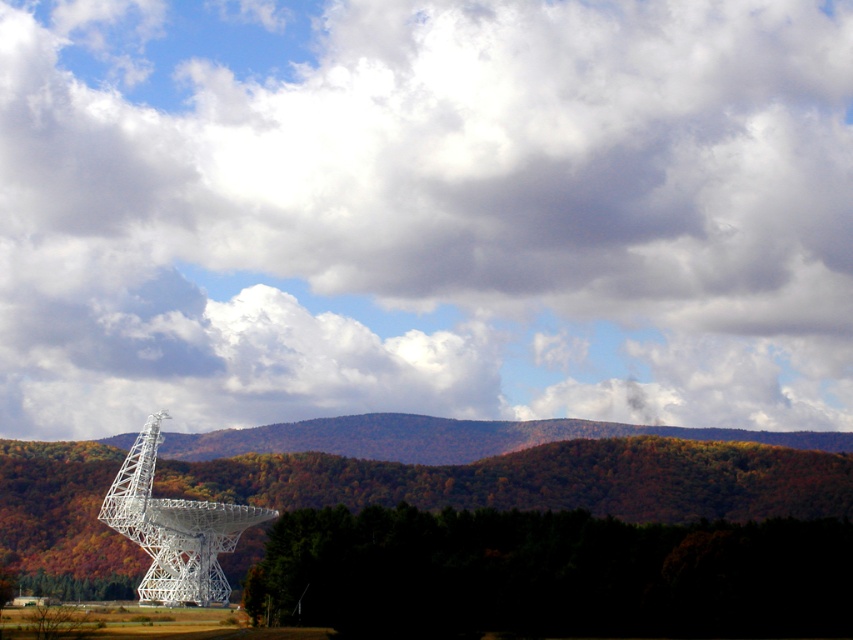
Who is more forward, (343, 196) or (148, 429)?

Point (148, 429)

Locate an element on the screen. Image resolution: width=853 pixels, height=640 pixels. cloudy sky at upper center is located at coordinates (424, 212).